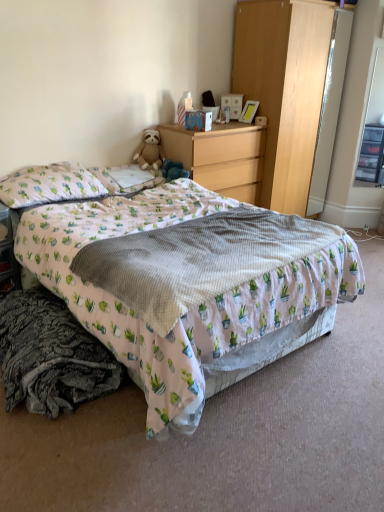
Image resolution: width=384 pixels, height=512 pixels. Find the location of `printed fabric bed at center`. printed fabric bed at center is located at coordinates (196, 287).

What is the approximate width of white textured blanket at center?

white textured blanket at center is 31.27 inches wide.

What do you see at coordinates (285, 88) in the screenshot?
I see `light wood dresser at upper right` at bounding box center [285, 88].

This screenshot has height=512, width=384. What do you see at coordinates (329, 110) in the screenshot?
I see `shiny silver mirror at right` at bounding box center [329, 110].

Image resolution: width=384 pixels, height=512 pixels. Find the location of `dark gray textured blanket at lower left`. dark gray textured blanket at lower left is located at coordinates (50, 355).

Consider the image. What is the approximate height of matte cardboard box at upper center?

It is 9.03 inches.

Identify the location of printed fabric bed at center. (x=196, y=287).

Between light pink fabric pillow at upper left, placed as the 1th pillow when sorted from left to right, and white textured blanket at center, which one has smaller width?

With smaller width is light pink fabric pillow at upper left, placed as the 1th pillow when sorted from left to right.

Is light pink fabric pillow at upper left, placed as the 1th pillow when sorted from left to right, completely or partially outside of white textured blanket at center?

Absolutely, light pink fabric pillow at upper left, placed as the 1th pillow when sorted from left to right, is external to white textured blanket at center.

From a real-world perspective, which is physically above, light pink fabric pillow at upper left, the second pillow viewed from the right, or white textured blanket at center?

From a 3D spatial view, light pink fabric pillow at upper left, the second pillow viewed from the right, is above.

From the image's perspective, is wooden chest of drawers at center above white textured blanket at center?

Indeed, from the image's perspective, wooden chest of drawers at center is shown above white textured blanket at center.

Is wooden chest of drawers at center positioned behind white textured blanket at center?

Yes, it is.

Would you say white textured blanket at center is part of wooden chest of drawers at center's contents?

That's incorrect, white textured blanket at center is not inside wooden chest of drawers at center.

Is wooden chest of drawers at center aimed at white textured blanket at center?

No, wooden chest of drawers at center is not oriented towards white textured blanket at center.

From the image's perspective, would you say white textured blanket at center is shown under matte cardboard box at upper center?

Yes.

In the scene shown: From a real-world perspective, which is physically below, white textured blanket at center or matte cardboard box at upper center?

From a 3D spatial view, white textured blanket at center is below.

Can you tell me how much white textured blanket at center and matte cardboard box at upper center differ in facing direction?

The angular difference between white textured blanket at center and matte cardboard box at upper center is 26.7 degrees.

Is white textured blanket at center turned away from matte cardboard box at upper center?

No, matte cardboard box at upper center is not at the back of white textured blanket at center.

Is wooden table at lower left in front of or behind white textured blanket at center in the image?

wooden table at lower left is behind white textured blanket at center.

This screenshot has height=512, width=384. Identify the location of blanket that is in front of the wooden table at lower left. (224, 273).

Can we say wooden table at lower left lies outside white textured blanket at center?

wooden table at lower left is positioned outside white textured blanket at center.

From the image's perspective, is wooden table at lower left above or below white textured blanket at center?

From the image's perspective, wooden table at lower left appears above white textured blanket at center.

Would you say light wood dresser at upper right is a long distance from printed fabric bed at center?

Absolutely, light wood dresser at upper right is distant from printed fabric bed at center.

Can we say light wood dresser at upper right lies outside printed fabric bed at center?

Yes.

At what (x,y) coordinates should I click in order to perform the action: click on bed in front of the light wood dresser at upper right. Please return your answer as a coordinate pair (x, y). The width and height of the screenshot is (384, 512). Looking at the image, I should click on (196, 287).

Consider the image. From the image's perspective, is light wood dresser at upper right on printed fabric bed at center?

Yes, from the image's perspective, light wood dresser at upper right is over printed fabric bed at center.

Which object is positioned more to the right, shiny silver mirror at right or wooden table at lower left?

From the viewer's perspective, shiny silver mirror at right appears more on the right side.

Which object is further away from the camera taking this photo, shiny silver mirror at right or wooden table at lower left?

Positioned behind is shiny silver mirror at right.

From a real-world perspective, is shiny silver mirror at right positioned above or below wooden table at lower left?

In terms of real-world spatial position, shiny silver mirror at right is above wooden table at lower left.

How different are the orientations of shiny silver mirror at right and wooden table at lower left in degrees?

There is a 0.103-degree angle between the facing directions of shiny silver mirror at right and wooden table at lower left.

Looking at their sizes, would you say wooden table at lower left is wider or thinner than matte cardboard box at upper center?

wooden table at lower left is wider than matte cardboard box at upper center.

Based on the photo, are wooden table at lower left and matte cardboard box at upper center far apart?

Yes, wooden table at lower left is far from matte cardboard box at upper center.

Considering the sizes of wooden table at lower left and matte cardboard box at upper center in the image, is wooden table at lower left bigger or smaller than matte cardboard box at upper center?

In the image, wooden table at lower left appears to be larger than matte cardboard box at upper center.

How much distance is there between wooden table at lower left and matte cardboard box at upper center?

1.62 meters.

Find the location of `blanket in front of the light pink fabric pillow at upper left, the second pillow viewed from the right`. blanket in front of the light pink fabric pillow at upper left, the second pillow viewed from the right is located at coordinates (224, 273).

This screenshot has height=512, width=384. Find the location of `desk above the white textured blanket at center (from a real-world perspective)`. desk above the white textured blanket at center (from a real-world perspective) is located at coordinates (220, 157).

Estimate the real-world distances between objects in this image. Which object is closer to matte cardboard box at upper center, light pink fabric pillow at upper left, placed as the 1th pillow when sorted from left to right, or printed fabric bed at center?

The object closer to matte cardboard box at upper center is light pink fabric pillow at upper left, placed as the 1th pillow when sorted from left to right.

Which object lies nearer to the anchor point matte cardboard box at upper center, light wood dresser at upper right or printed fabric bed at center?

The object closer to matte cardboard box at upper center is light wood dresser at upper right.

Which object lies further to the anchor point dark gray textured blanket at lower left, soft brown teddy bear at center or printed fabric bed at center?

soft brown teddy bear at center.

Based on their spatial positions, is wooden table at lower left or light pink fabric pillow at upper left, the second pillow viewed from the right, closer to shiny silver mirror at right?

light pink fabric pillow at upper left, the second pillow viewed from the right, is closer to shiny silver mirror at right.

Estimate the real-world distances between objects in this image. Which object is further from soft brown teddy bear at center, matte cardboard box at upper center or wooden table at lower left?

wooden table at lower left is positioned further to the anchor soft brown teddy bear at center.

Estimate the real-world distances between objects in this image. Which object is further from white fabric pillow at upper left, which is counted as the 2th pillow, starting from the left, printed fabric bed at center or transparent plastic drawers at right?

transparent plastic drawers at right is further to white fabric pillow at upper left, which is counted as the 2th pillow, starting from the left.

Looking at the image, which one is located closer to soft brown teddy bear at center, white textured blanket at center or light pink fabric pillow at upper left, placed as the 1th pillow when sorted from left to right?

Among the two, light pink fabric pillow at upper left, placed as the 1th pillow when sorted from left to right, is located nearer to soft brown teddy bear at center.

Considering their positions, is wooden chest of drawers at center positioned closer to white textured blanket at center than transparent plastic drawers at right?

The object closer to white textured blanket at center is wooden chest of drawers at center.

Identify the location of desk between white textured blanket at center and soft brown teddy bear at center along the z-axis. The width and height of the screenshot is (384, 512). (220, 157).

The width and height of the screenshot is (384, 512). In order to click on blanket positioned between printed fabric bed at center and soft brown teddy bear at center from near to far in this screenshot , I will do `click(224, 273)`.

Locate an element on the screen. blanket between light pink fabric pillow at upper left, placed as the 1th pillow when sorted from left to right, and transparent plastic drawers at right, in the horizontal direction is located at coordinates (224, 273).

I want to click on material between printed fabric bed at center and soft brown teddy bear at center along the z-axis, so click(50, 355).